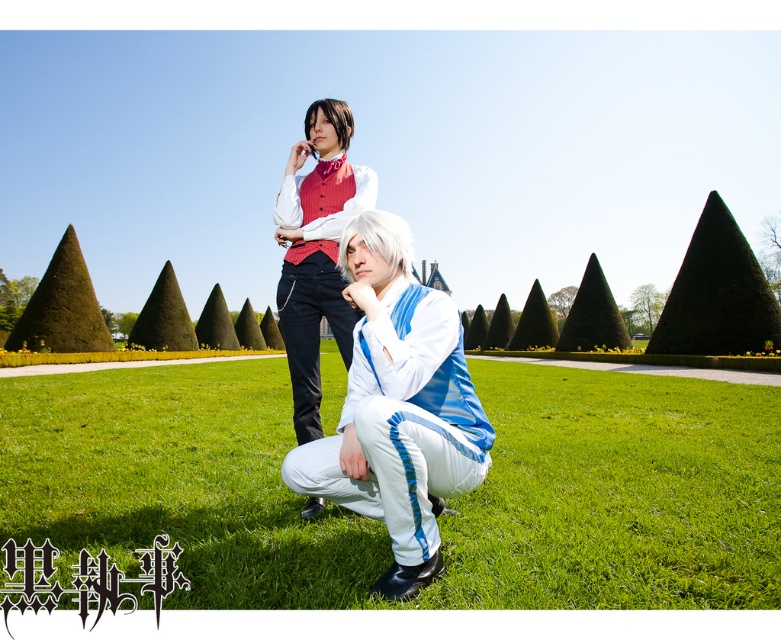
Question: Observing the image, what is the correct spatial positioning of green grass at lower center in reference to matte red vest at upper center?

Choices:
 (A) right
 (B) left

Answer: (B)

Question: Among these objects, which one is farthest from the camera?

Choices:
 (A) green grass at lower center
 (B) matte red vest at upper center
 (C) white glossy suit at center

Answer: (B)

Question: Which object is closer to the camera taking this photo?

Choices:
 (A) green grass at lower center
 (B) matte red vest at upper center
 (C) white glossy suit at center

Answer: (C)

Question: Which is farther from the matte red vest at upper center?

Choices:
 (A) white glossy suit at center
 (B) green grass at lower center

Answer: (B)

Question: Is green grass at lower center further to the viewer compared to matte red vest at upper center?

Choices:
 (A) no
 (B) yes

Answer: (A)

Question: Can you confirm if green grass at lower center is wider than matte red vest at upper center?

Choices:
 (A) yes
 (B) no

Answer: (A)